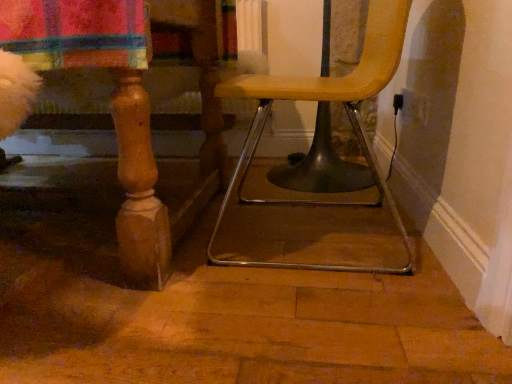
This screenshot has height=384, width=512. I want to click on free spot to the left of wooden chair at center, so click(136, 279).